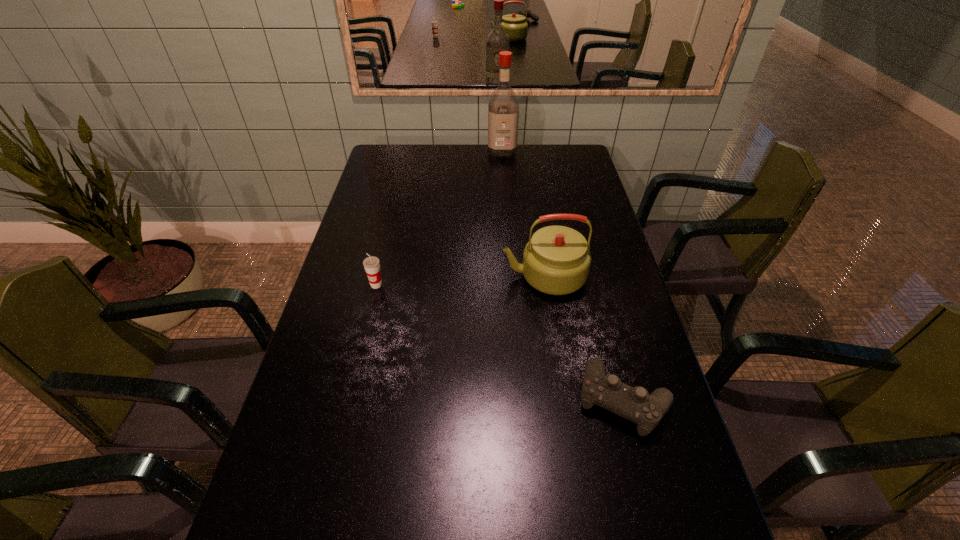
Locate an element on the screen. The image size is (960, 540). the tallest object is located at coordinates (503, 105).

The width and height of the screenshot is (960, 540). Find the location of `the farthest object`. the farthest object is located at coordinates (503, 105).

I want to click on the third shortest object, so click(x=556, y=260).

The height and width of the screenshot is (540, 960). What are the coordinates of `the leftmost object` in the screenshot? It's located at (371, 264).

Find the location of `cup`. cup is located at coordinates (371, 264).

Identify the location of the shortest object. The height and width of the screenshot is (540, 960). (635, 404).

Where is `the nearest object`? The image size is (960, 540). the nearest object is located at coordinates (635, 404).

Locate an element on the screen. Image resolution: width=960 pixels, height=540 pixels. free space located on the front-facing side of the farthest object is located at coordinates (506, 199).

Identify the location of vacant space located 0.210m at the spout of the third shortest object. (434, 276).

Locate an element on the screen. This screenshot has height=540, width=960. vacant space positioned at the spout of the third shortest object is located at coordinates pyautogui.click(x=467, y=276).